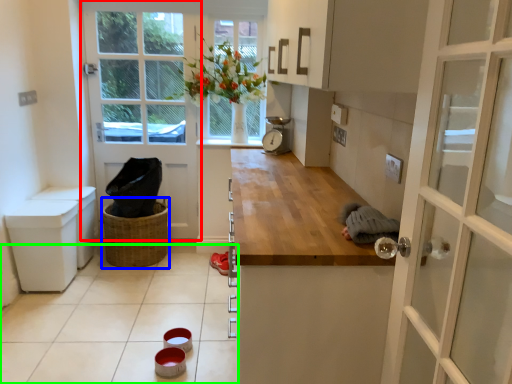
Question: Which is nearer to the door (highlighted by a red box)? basket (highlighted by a blue box) or tile (highlighted by a green box).

Choices:
 (A) basket
 (B) tile

Answer: (A)